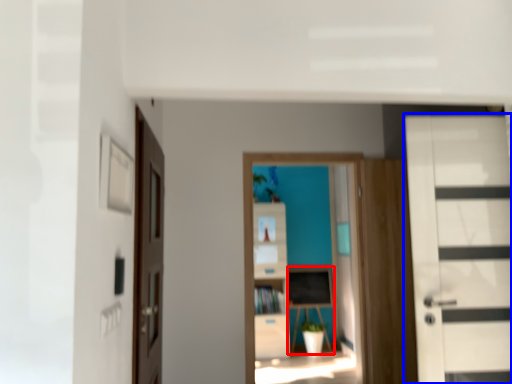
Question: Which of the following is the farthest to the observer, table (highlighted by a red box) or door (highlighted by a blue box)?

Choices:
 (A) table
 (B) door

Answer: (A)